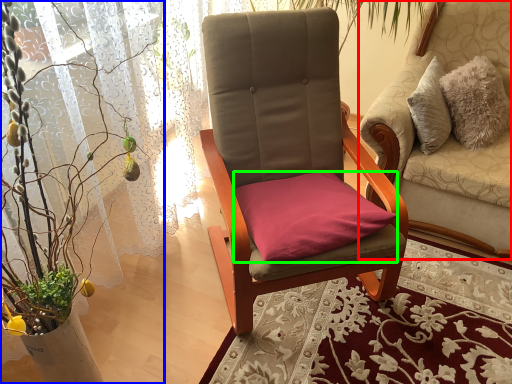
Question: Considering the real-world distances, which object is farthest from chair (highlighted by a red box)? houseplant (highlighted by a blue box) or pillow (highlighted by a green box)?

Choices:
 (A) houseplant
 (B) pillow

Answer: (A)